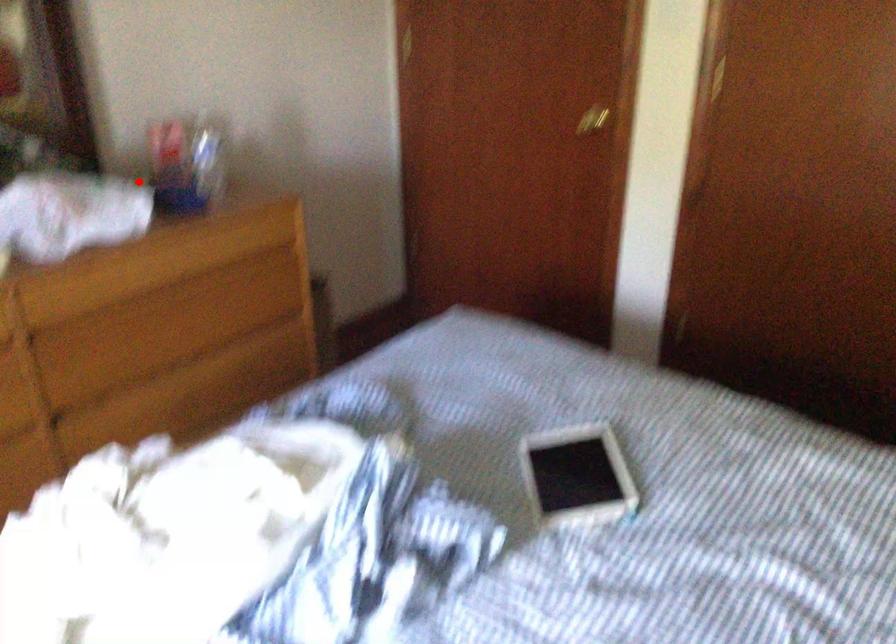
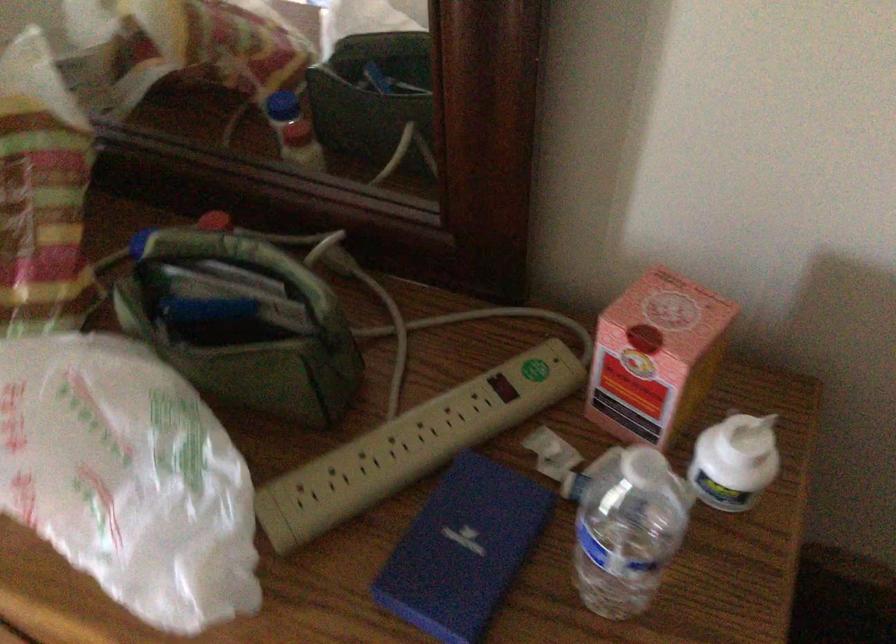
Question: I am providing you with two images of the same scene from different viewpoints. Image1 has a red point marked. In image2, the corresponding 3D location appears at what relative position? Reply with the corresponding letter.

Choices:
 (A) Closer
 (B) Farther

Answer: (A)